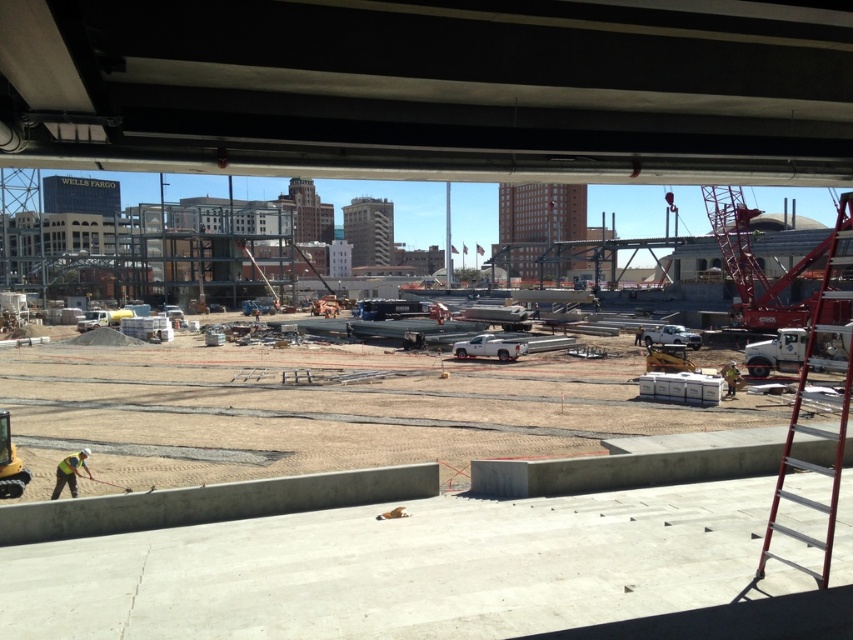
Question: Which point is farther from the camera taking this photo?

Choices:
 (A) (578, 524)
 (B) (61, 480)

Answer: (B)

Question: Does concrete at center appear under yellow reflective vest at lower left?

Choices:
 (A) yes
 (B) no

Answer: (B)

Question: Which of the following is the farthest from the observer?

Choices:
 (A) (296, 456)
 (B) (64, 460)

Answer: (A)

Question: In this image, where is concrete at center located relative to yellow reflective vest at lower left?

Choices:
 (A) above
 (B) below

Answer: (A)

Question: Among these points, which one is farthest from the camera?

Choices:
 (A) (527, 380)
 (B) (746, 307)

Answer: (B)

Question: Can you confirm if red metallic crane at upper right is thinner than yellow reflective vest at lower left?

Choices:
 (A) no
 (B) yes

Answer: (A)